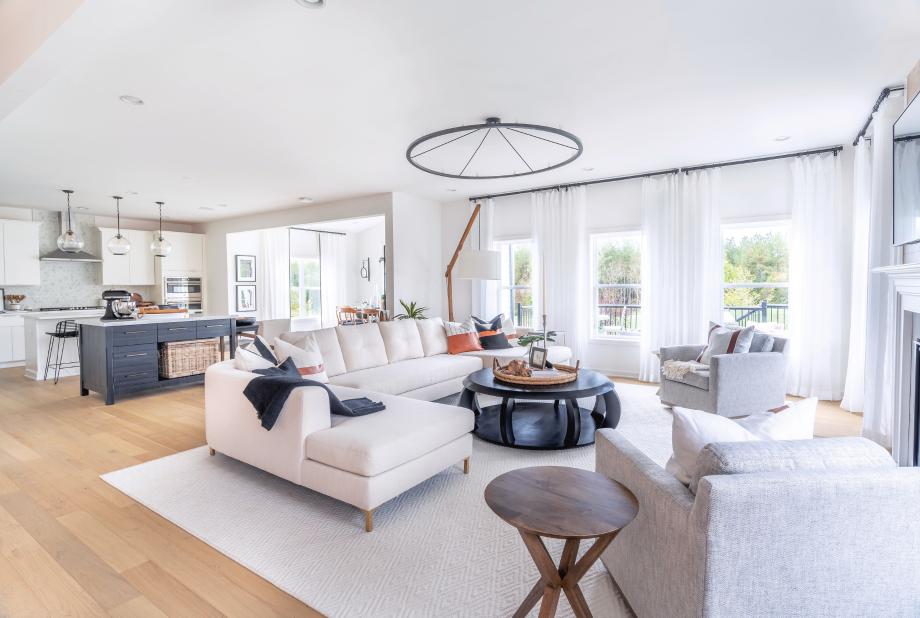
Where is `stove vent`? This screenshot has width=920, height=618. stove vent is located at coordinates click(72, 253).